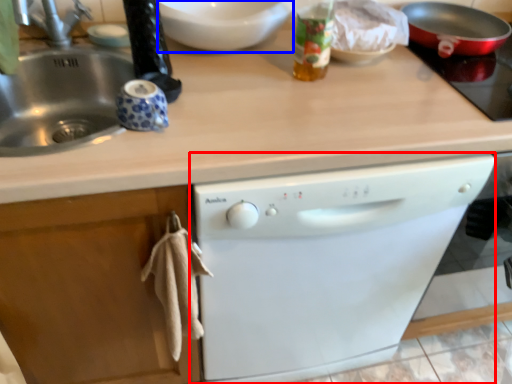
Question: Which object is further to the camera taking this photo, dishwasher (highlighted by a red box) or mixing bowl (highlighted by a blue box)?

Choices:
 (A) dishwasher
 (B) mixing bowl

Answer: (B)